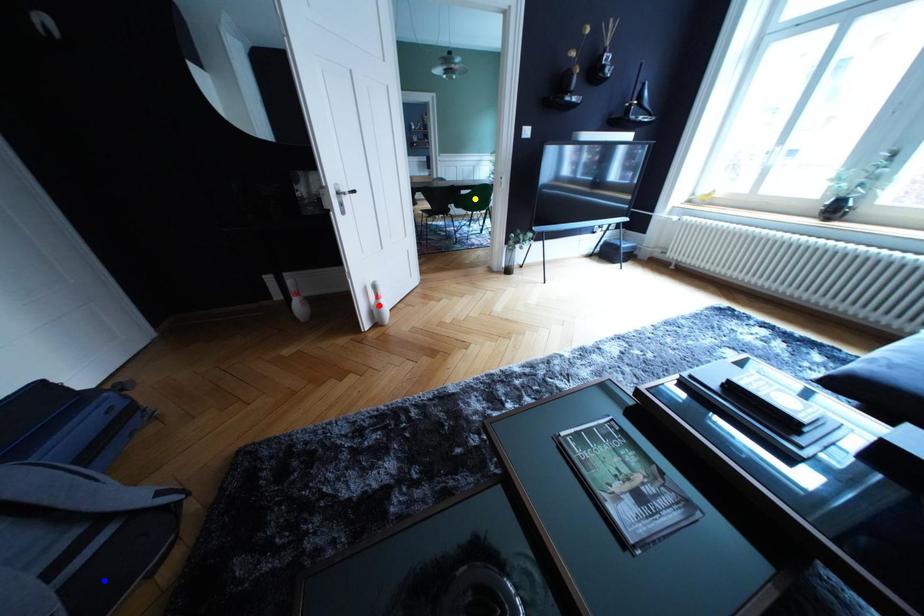
Order these from farthest to nearest:
1. blue point
2. red point
3. yellow point

yellow point
red point
blue point